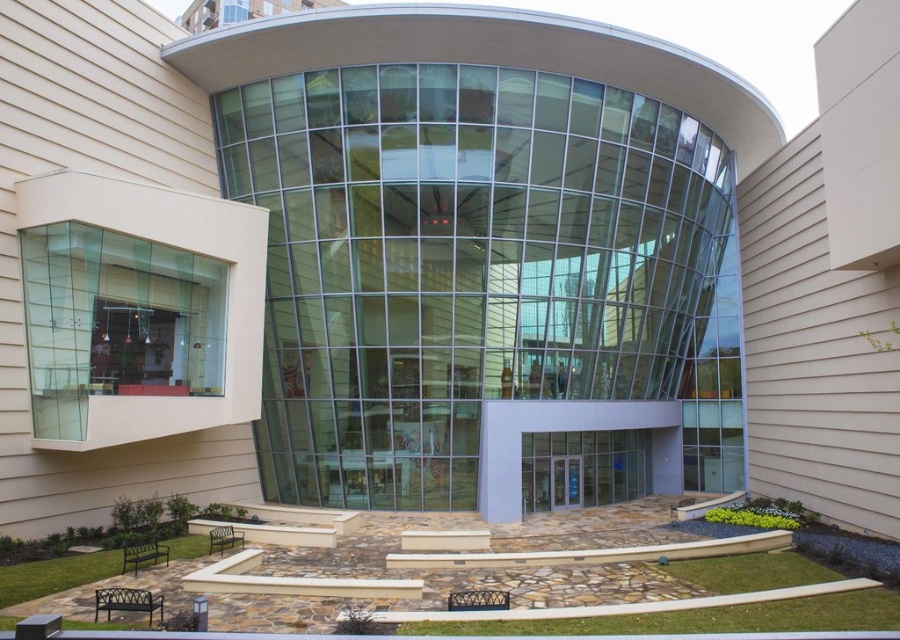
You are standing in front of the modern building and want to enter through the entrance. Which clear glass doors at center should you use, the one above or below the clear glass door at center?

The clear glass doors at center is positioned over the clear glass door at center, so you should use the doors located above the clear glass door at center to enter the building.

You are standing in front of the modern building and notice two points marked on the glass facade. The first point is at coordinates point [648,456] and the second is at point [569,483]. Which point is closer to your eyes?

Point [569,483] is closer to your eyes because it is less further to the camera than point [648,456].

You are a delivery person trying to enter the building through the clear glass doors at center and the clear glass door at center. Can you pass through them if you are carrying a large package that is 20 inches wide?

The clear glass doors at center and clear glass door at center are 19.65 inches apart, so the package that is 20 inches wide cannot fit through the gap between them.